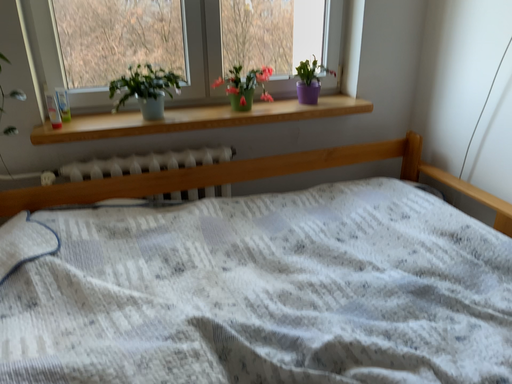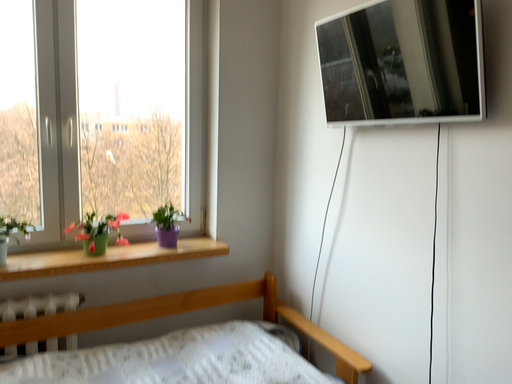
Question: Which way did the camera rotate in the video?

Choices:
 (A) rotated downward
 (B) rotated upward

Answer: (B)